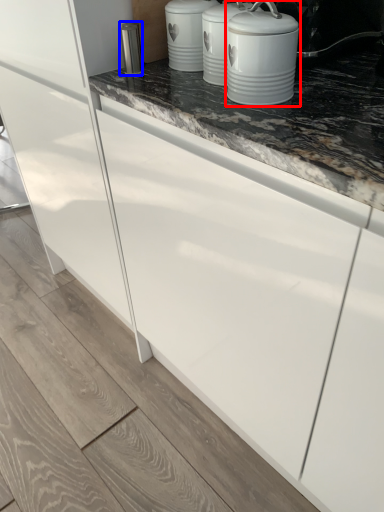
Question: Which of the following is the farthest to the observer, home appliance (highlighted by a red box) or appliance (highlighted by a blue box)?

Choices:
 (A) home appliance
 (B) appliance

Answer: (B)